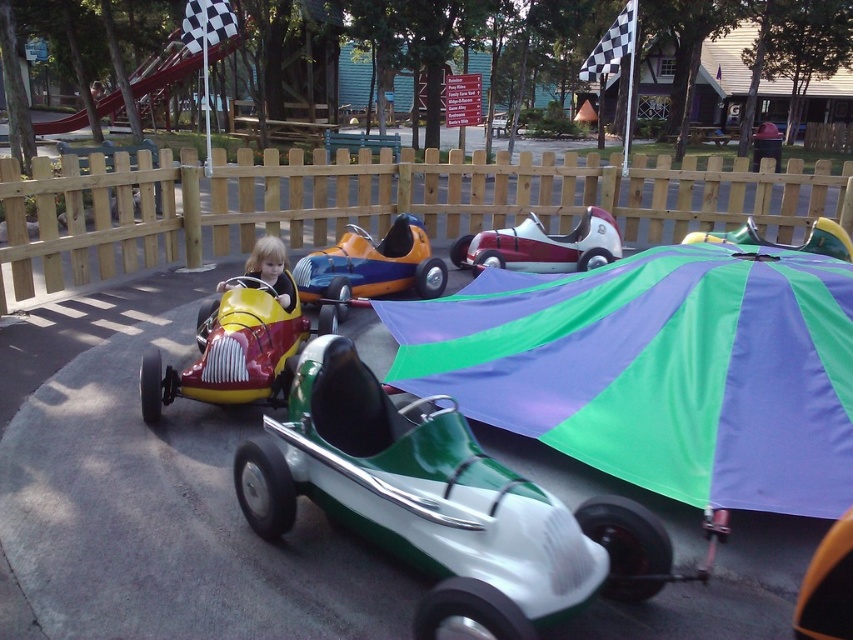
Question: Can you confirm if green and purple striped umbrella at center is bigger than metallic silver car at center?

Choices:
 (A) yes
 (B) no

Answer: (A)

Question: Which point is closer to the camera taking this photo?

Choices:
 (A) (425, 280)
 (B) (746, 252)
 (C) (263, 292)

Answer: (C)

Question: Which point is farther from the camera taking this photo?

Choices:
 (A) (839, 237)
 (B) (491, 541)
 (C) (708, 412)
 (D) (457, 260)

Answer: (D)

Question: Which is nearer to the shiny red toy car at center?

Choices:
 (A) metallic silver umbrella at center
 (B) green and purple striped umbrella at center
 (C) shiny green and white car at center
 (D) metallic silver car at center

Answer: (C)

Question: Does shiny orange and blue car at center have a smaller size compared to metallic silver car at center?

Choices:
 (A) yes
 (B) no

Answer: (B)

Question: Does metallic silver car at center appear under smooth yellow car at center?

Choices:
 (A) no
 (B) yes

Answer: (A)